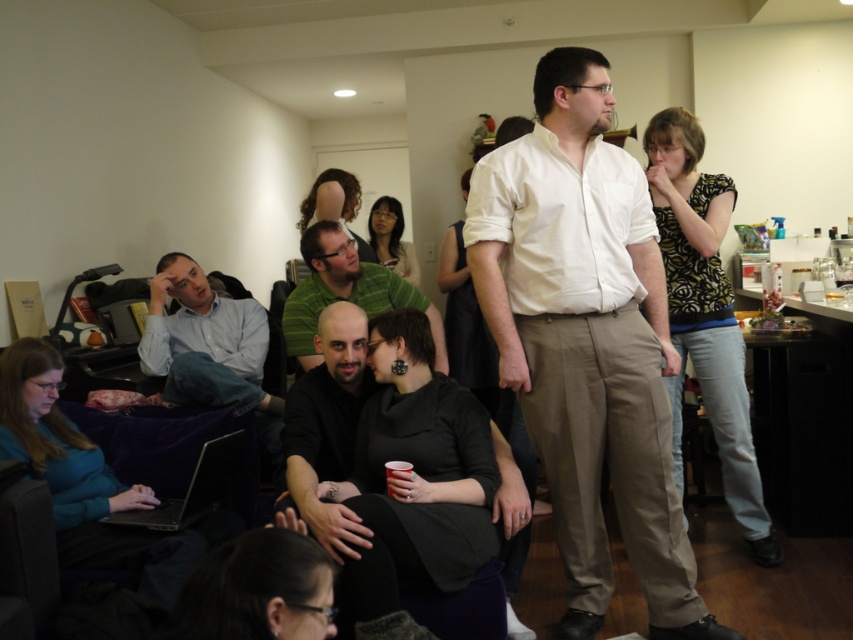
Does point (361, 276) come behind point (405, 465)?

Yes, point (361, 276) is farther from viewer.

The width and height of the screenshot is (853, 640). What are the coordinates of `green matte shirt at center` in the screenshot? It's located at (345, 291).

Does matte blue shirt at left have a larger size compared to green matte shirt at center?

Yes, matte blue shirt at left is bigger than green matte shirt at center.

Does matte blue shirt at left lie behind green matte shirt at center?

Yes, it is.

Which is behind, point (210, 308) or point (347, 273)?

The point (210, 308) is more distant.

Identify the location of matte blue shirt at left. This screenshot has height=640, width=853. (206, 342).

Who is more distant from viewer, (x=366, y=269) or (x=109, y=515)?

Point (x=366, y=269)

Where is `black matte shirt at center`? Image resolution: width=853 pixels, height=640 pixels. black matte shirt at center is located at coordinates (346, 289).

Which is in front, point (294, 298) or point (216, 468)?

Point (216, 468)

The height and width of the screenshot is (640, 853). I want to click on black matte shirt at center, so click(346, 289).